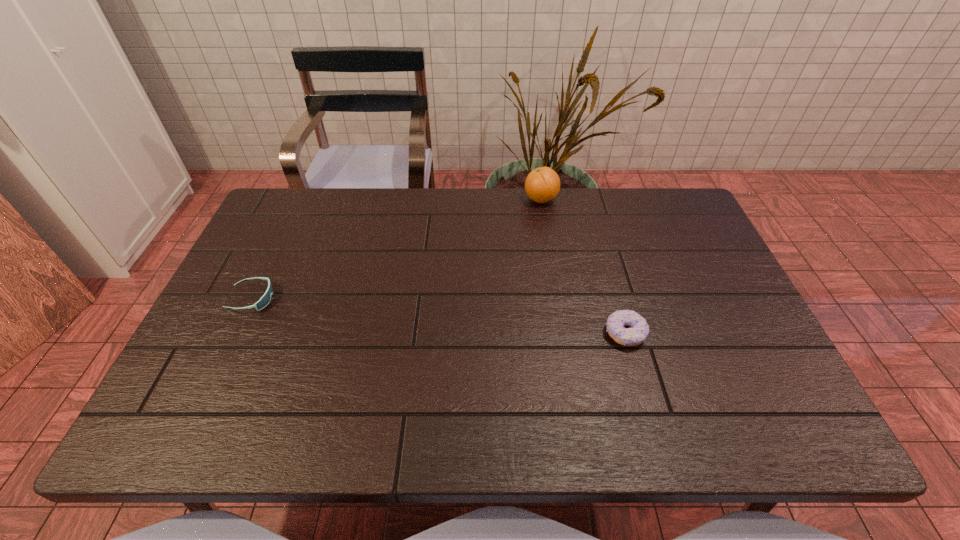
The image size is (960, 540). What are the coordinates of `object that is at the left edge` in the screenshot? It's located at (265, 299).

This screenshot has width=960, height=540. In the image, there is a desktop. In order to click on free space at the far edge in this screenshot , I will do `click(620, 208)`.

Where is `free spot at the near edge of the desktop`? free spot at the near edge of the desktop is located at coordinates (486, 434).

Image resolution: width=960 pixels, height=540 pixels. Identify the location of vacant area at the left edge. coord(192,353).

I want to click on free point at the right edge, so click(x=662, y=264).

What are the coordinates of `free point at the far right corner` in the screenshot? It's located at (647, 198).

In the image, there is a desktop. What are the coordinates of `vacant space at the near right corner` in the screenshot? It's located at (743, 435).

Where is `empty location between the rightmost object and the shortest object`? Image resolution: width=960 pixels, height=540 pixels. empty location between the rightmost object and the shortest object is located at coordinates (439, 316).

At what (x,y) coordinates should I click in order to perform the action: click on unoccupied area between the leftmost object and the doughnut. Please return your answer as a coordinate pair (x, y). Looking at the image, I should click on (439, 316).

The height and width of the screenshot is (540, 960). I want to click on empty space that is in between the farthest object and the second shortest object, so click(x=583, y=266).